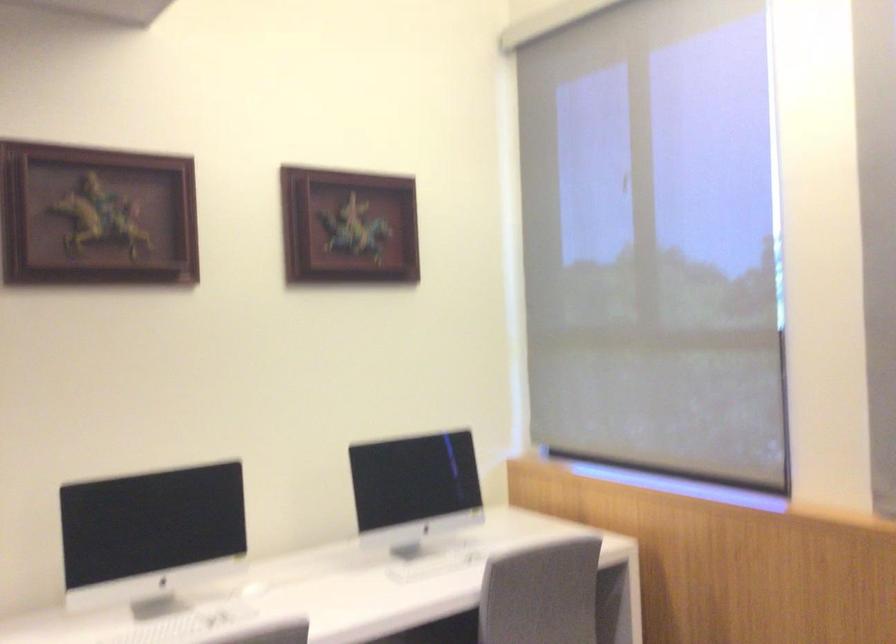
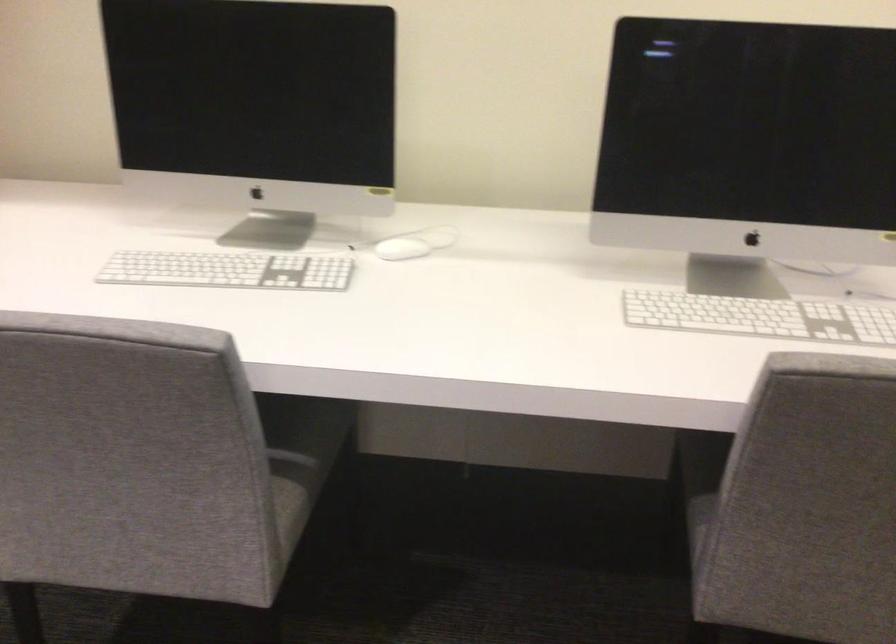
Locate, in the second image, the point that corresponds to point 452,565 in the first image.

(760, 317)